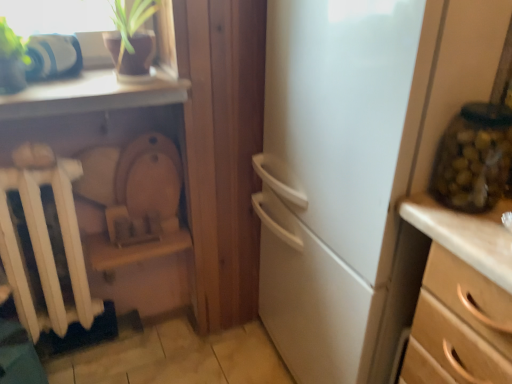
Find the location of a particular element. This screenshot has height=384, width=512. free spot in front of green glass jar at right is located at coordinates (479, 234).